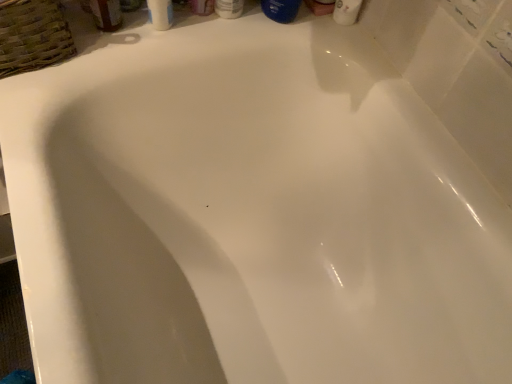
The width and height of the screenshot is (512, 384). I want to click on vacant space in front of woven brown basket at upper left, so coord(29,107).